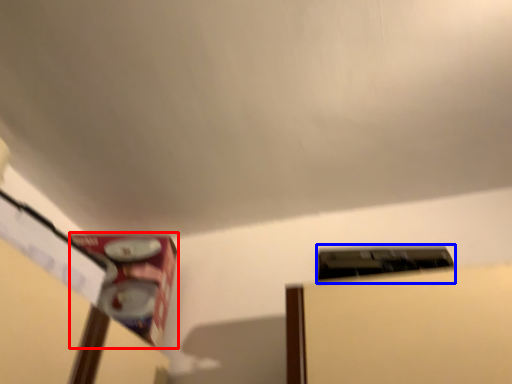
Question: Which point is further to the camera, water heater (highlighted by a red box) or water heater (highlighted by a blue box)?

Choices:
 (A) water heater
 (B) water heater

Answer: (A)